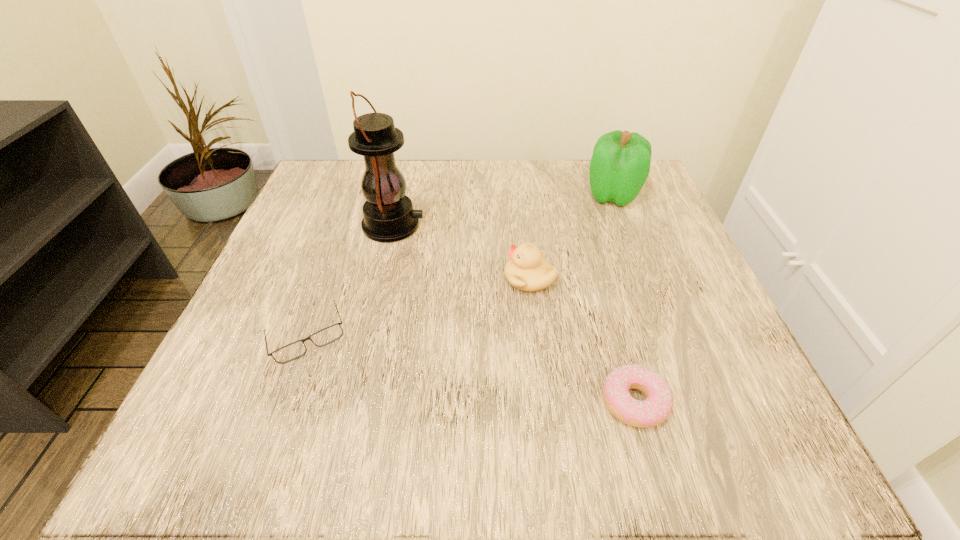
Where is `the tallest object`? This screenshot has width=960, height=540. the tallest object is located at coordinates (388, 216).

The width and height of the screenshot is (960, 540). I want to click on bell pepper, so click(620, 164).

At what (x,y) coordinates should I click in order to perform the action: click on duckling. Please return your answer as a coordinate pair (x, y). Looking at the image, I should click on (527, 270).

Find the location of a particular element. the third shortest object is located at coordinates (527, 270).

Locate an element on the screen. spectacles is located at coordinates (292, 351).

Locate an element on the screen. The height and width of the screenshot is (540, 960). the nearest object is located at coordinates (657, 406).

Find a few locations in blank space located 0.210m above the tallest object, indicating its light source. Please provide its 2D coordinates. Your answer should be formatted as a tuple, i.e. [(x, y)], where the tuple contains the x and y coordinates of a point satisfying the conditions above.

[(526, 226)]

Locate an element on the screen. The width and height of the screenshot is (960, 540). vacant space situated on the back of the fourth shortest object is located at coordinates (602, 167).

The height and width of the screenshot is (540, 960). Identify the location of vacant space located on the beak of the duckling. (438, 279).

The width and height of the screenshot is (960, 540). In order to click on vacant region located on the beak of the duckling in this screenshot , I will do `click(438, 279)`.